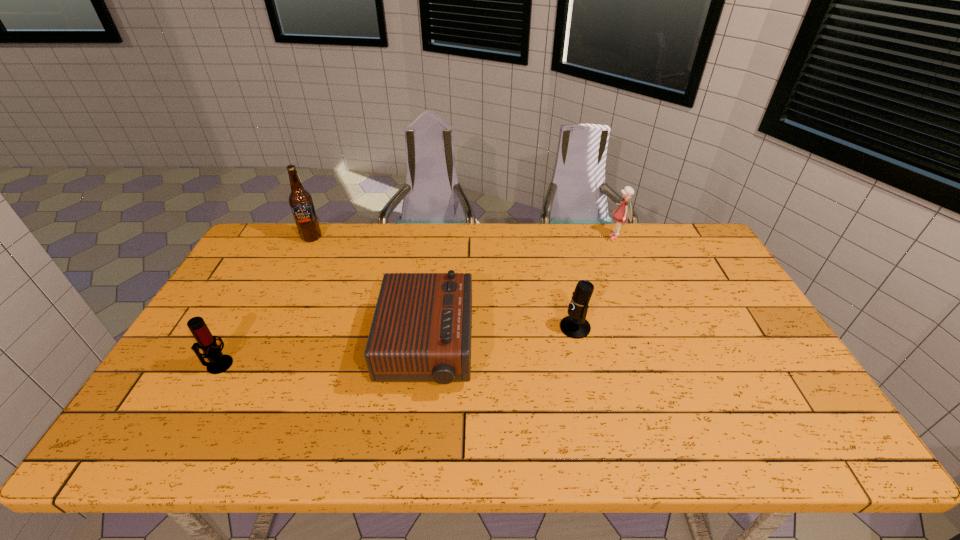
Where is `vacant position located 0.070m on the front-facing side of the doll`? The image size is (960, 540). vacant position located 0.070m on the front-facing side of the doll is located at coordinates (588, 237).

Locate an element on the screen. This screenshot has height=540, width=960. vacant space situated 0.350m on the front-facing side of the doll is located at coordinates (510, 237).

The image size is (960, 540). I want to click on vacant space located on the front-facing side of the doll, so click(535, 237).

You are a GUI agent. You are given a task and a screenshot of the screen. Output one action in this format:
    pyautogui.click(x=<x>, y=<y>)
    Task: Click on the free point located on the right of the nearer microphone
    The height and width of the screenshot is (540, 960).
    Given the screenshot: What is the action you would take?
    pyautogui.click(x=286, y=364)

Where is `free location located on the left of the fourth object from left to right`? The height and width of the screenshot is (540, 960). free location located on the left of the fourth object from left to right is located at coordinates (457, 327).

Identify the location of vacant region located on the tuning display of the radio receiver. (579, 348).

Locate an element on the screen. The width and height of the screenshot is (960, 540). beer bottle located at the far edge is located at coordinates (301, 203).

Locate an element on the screen. The height and width of the screenshot is (540, 960). doll that is positioned at the far edge is located at coordinates (624, 211).

Find the location of a particular element. The width and height of the screenshot is (960, 540). beer bottle located at the left edge is located at coordinates (301, 203).

The width and height of the screenshot is (960, 540). In order to click on microphone present at the left edge in this screenshot , I will do `click(218, 363)`.